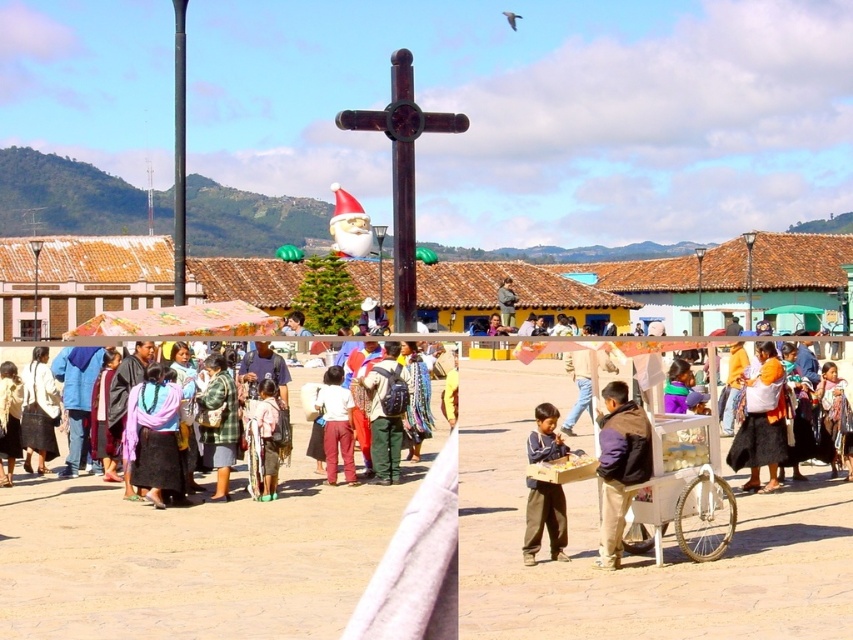
Which is behind, point (699, 538) or point (386, 364)?

Positioned behind is point (386, 364).

Find the location of a particular element. This screenshot has height=640, width=853. white plastic cart at center is located at coordinates (682, 500).

Identify the location of plaid fabric skirt at center. (218, 422).

Between point (225, 465) and point (335, 429), which one is positioned behind?

The point (335, 429) is more distant.

Who is more forward, (210, 429) or (346, 419)?

Point (210, 429) is more forward.

The width and height of the screenshot is (853, 640). In order to click on plaid fabric skirt at center in this screenshot , I will do `click(218, 422)`.

Can you confirm if brown wooden cross at center is thinner than plaid fabric skirt at center?

No, brown wooden cross at center is not thinner than plaid fabric skirt at center.

Based on the photo, is brown wooden cross at center shorter than plaid fabric skirt at center?

In fact, brown wooden cross at center may be taller than plaid fabric skirt at center.

Locate an element on the screen. Image resolution: width=853 pixels, height=640 pixels. brown wooden cross at center is located at coordinates (402, 172).